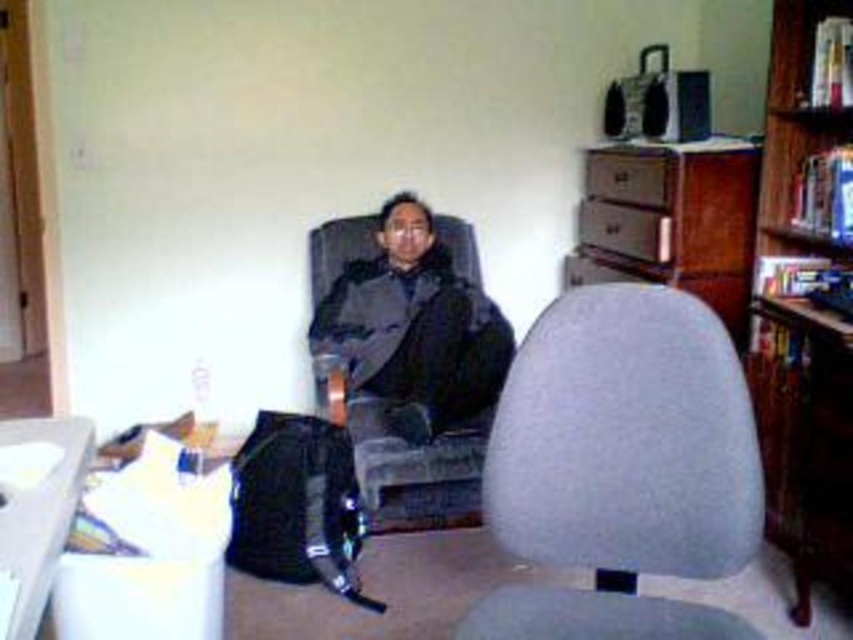
Does gray fabric swivel chair at center have a smaller size compared to dark gray fabric jacket at center?

Indeed, gray fabric swivel chair at center has a smaller size compared to dark gray fabric jacket at center.

Is point (492, 618) positioned before point (347, 324)?

Yes, it is.

The height and width of the screenshot is (640, 853). Identify the location of gray fabric swivel chair at center. (621, 467).

Does gray fabric swivel chair at center have a greater width compared to white plastic computer desk at lower left?

Correct, the width of gray fabric swivel chair at center exceeds that of white plastic computer desk at lower left.

Is gray fabric swivel chair at center thinner than white plastic computer desk at lower left?

In fact, gray fabric swivel chair at center might be wider than white plastic computer desk at lower left.

Is point (502, 438) closer to camera compared to point (28, 432)?

Yes, point (502, 438) is closer to viewer.

Locate an element on the screen. gray fabric swivel chair at center is located at coordinates (621, 467).

Is point (619, 604) positioned in front of point (833, 493)?

Yes, point (619, 604) is in front of point (833, 493).

Can you confirm if gray fabric swivel chair at center is positioned below wooden bookshelf at upper right?

Yes.

What do you see at coordinates (621, 467) in the screenshot? The width and height of the screenshot is (853, 640). I see `gray fabric swivel chair at center` at bounding box center [621, 467].

Identify the location of gray fabric swivel chair at center. (621, 467).